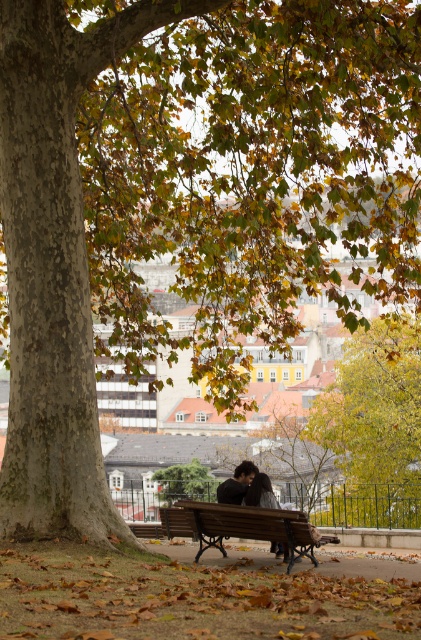
Consider the image. You are standing at the camera position and want to walk towards the brown leaf litter at lower center. What coordinates should you aim for to reach it?

The brown leaf litter at lower center is located at coordinates point [191,600], so you should aim for point [191,600] to reach it.

You are standing at the center of the park and want to pick up the brown leaf litter at lower center. According to the coordinates provided, in which direction should you move to reach it?

The brown leaf litter at lower center is located at coordinates point (191, 600). Since the coordinate system typically has (0, 0) at the bottom left corner, moving towards the right and slightly upwards from the center would reach the leaf litter.

You are a gardener who needs to clear the brown leaf litter at lower center. You have a rake that can reach 8 meters. Can you reach the leaf litter from your current position next to the wooden bench at center without moving closer?

The brown leaf litter at lower center and wooden bench at center are 7.90 meters apart. Since the rake can reach 8 meters, you can just barely reach the leaf litter from your current position next to the wooden bench at center without moving closer.